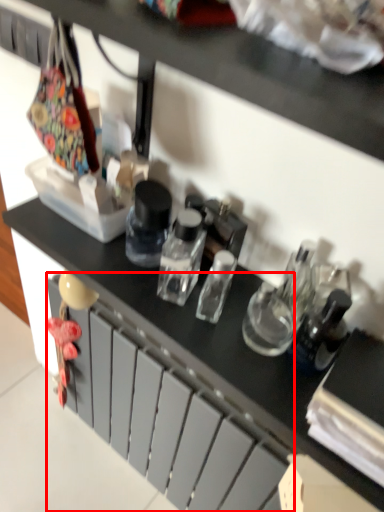
Question: From the image's perspective, where is drawer (annotated by the red box) located relative to bottle?

Choices:
 (A) below
 (B) above

Answer: (A)